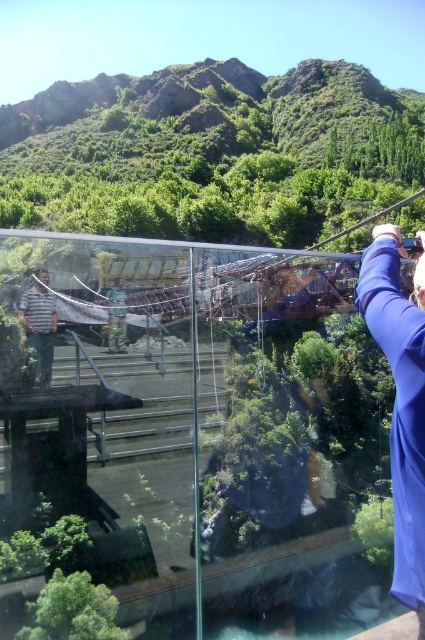
Question: Which of the following is the farthest from the observer?

Choices:
 (A) (116, 333)
 (B) (28, 339)

Answer: (A)

Question: Which object is positioned farthest from the striped fabric shirt at left?

Choices:
 (A) camouflage fabric jacket at center
 (B) blue fabric at right

Answer: (B)

Question: Which object is farther from the camera taking this photo?

Choices:
 (A) blue fabric at right
 (B) camouflage fabric jacket at center

Answer: (B)

Question: In this image, where is blue fabric at right located relative to striped fabric shirt at left?

Choices:
 (A) above
 (B) below

Answer: (B)

Question: In this image, where is blue fabric at right located relative to striped fabric shirt at left?

Choices:
 (A) above
 (B) below

Answer: (B)

Question: Does striped fabric shirt at left have a smaller size compared to camouflage fabric jacket at center?

Choices:
 (A) no
 (B) yes

Answer: (B)